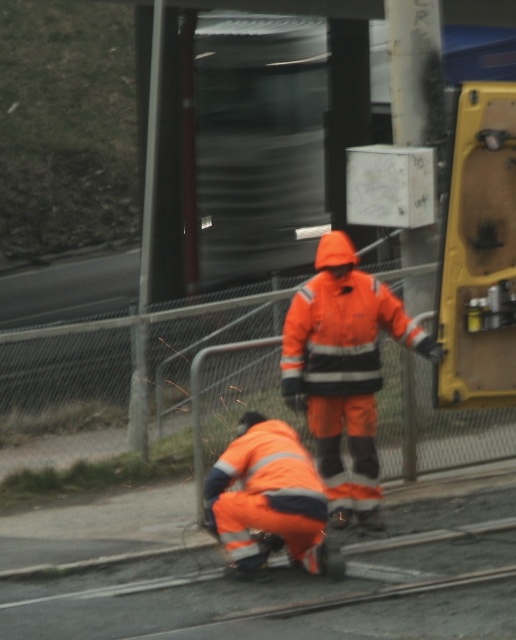
From the picture: You are a safety inspector standing at the camera position. You need to check if the orange reflective suit at center is within the safe inspection range of 30 feet. Is it within the range?

The orange reflective suit at center is 30.84 feet away from the camera, which exceeds the safe inspection range of 30 feet. Therefore, it is not within the safe range.

You are a pedestrian standing on the road side of the chain link fence near the railway. You see the orange reflective suit at center and the reflective orange jumpsuit at lower center. Which worker is closer to the tracks?

The reflective orange jumpsuit at lower center is closer to the tracks because it is positioned to the left of the orange reflective suit at center, which is further away.